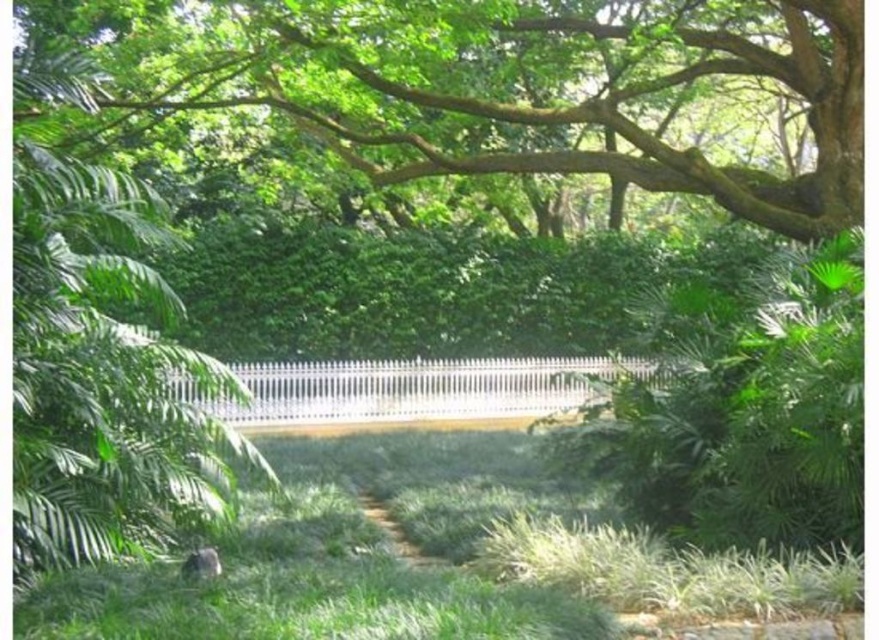
Question: Which point appears closest to the camera in this image?

Choices:
 (A) (110, 186)
 (B) (786, 67)
 (C) (466, 435)

Answer: (A)

Question: Does green leafy tree at center appear on the right side of green leafy tree at upper center?

Choices:
 (A) no
 (B) yes

Answer: (A)

Question: Estimate the real-world distances between objects in this image. Which object is closer to the green leafy tree at upper center?

Choices:
 (A) green grass at center
 (B) green leafy tree at center

Answer: (A)

Question: Does green leafy tree at center have a smaller size compared to green leafy tree at upper center?

Choices:
 (A) yes
 (B) no

Answer: (A)

Question: Is green leafy tree at center to the left of green leafy tree at upper center from the viewer's perspective?

Choices:
 (A) no
 (B) yes

Answer: (B)

Question: Which object appears closest to the camera in this image?

Choices:
 (A) green leafy tree at upper center
 (B) green grass at center

Answer: (B)